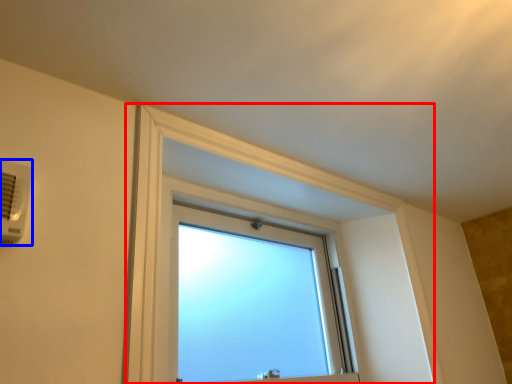
Question: Which object is closer to the camera taking this photo, bay window (highlighted by a red box) or air conditioning (highlighted by a blue box)?

Choices:
 (A) bay window
 (B) air conditioning

Answer: (B)